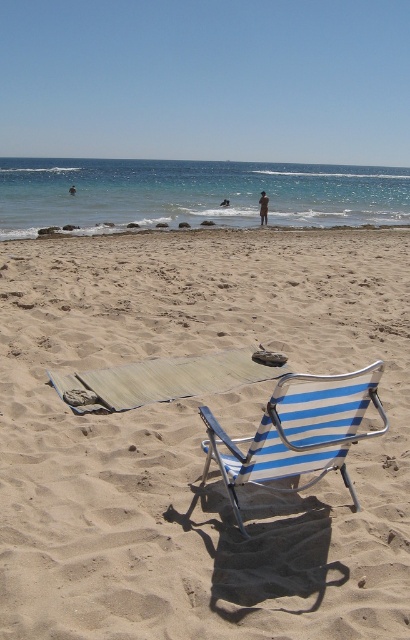
Find the location of a particular element. The height and width of the screenshot is (640, 410). beige sand at center is located at coordinates (196, 440).

Who is more forward, (22, 355) or (250, 444)?

Positioned in front is point (250, 444).

Identify the location of beige sand at center. (196, 440).

Can you confirm if blue striped fabric beach chair at center is smaller than brown textured person at center?

Indeed, blue striped fabric beach chair at center has a smaller size compared to brown textured person at center.

Is blue striped fabric beach chair at center to the right of brown textured person at center from the viewer's perspective?

Incorrect, blue striped fabric beach chair at center is not on the right side of brown textured person at center.

Which is in front, point (353, 497) or point (261, 220)?

Point (353, 497) is in front.

At what (x,y) coordinates should I click in order to perform the action: click on blue striped fabric beach chair at center. Please return your answer as a coordinate pair (x, y). Looking at the image, I should click on coord(298,432).

Which is in front, point (120, 474) or point (70, 192)?

Point (120, 474) is more forward.

This screenshot has width=410, height=640. What are the coordinates of `beige sand at center` in the screenshot? It's located at (196, 440).